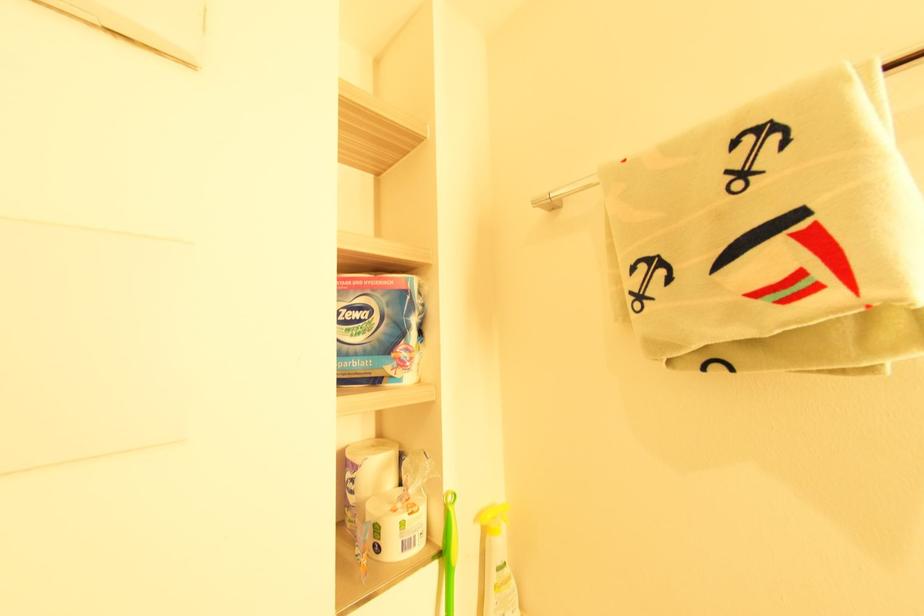
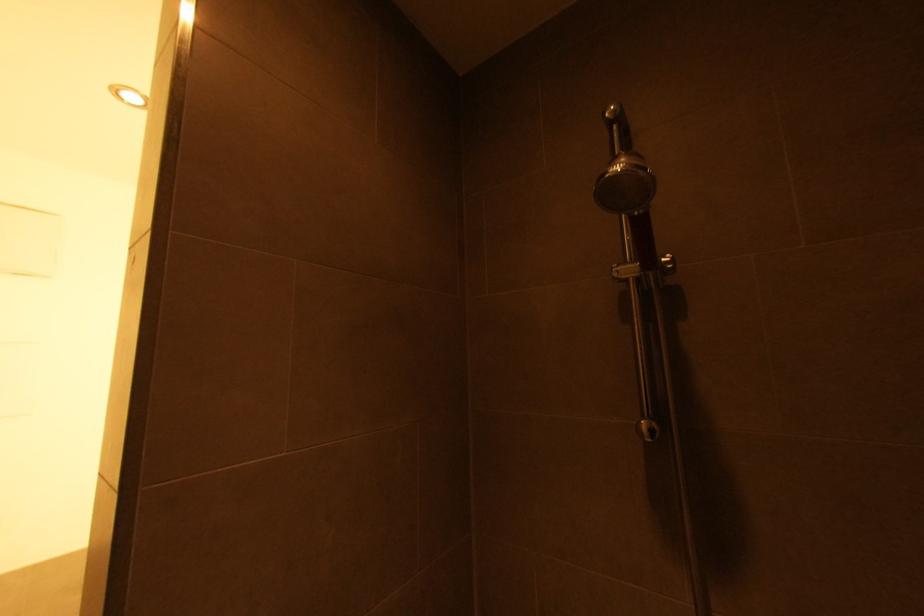
Which direction would the cameraman need to move to produce the second image?

The cameraman moved toward right, backward.